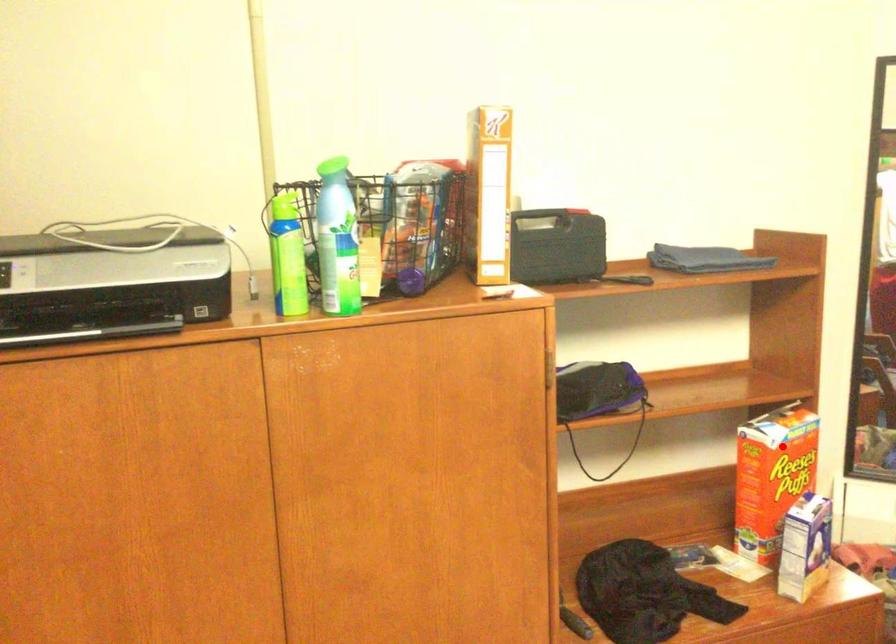
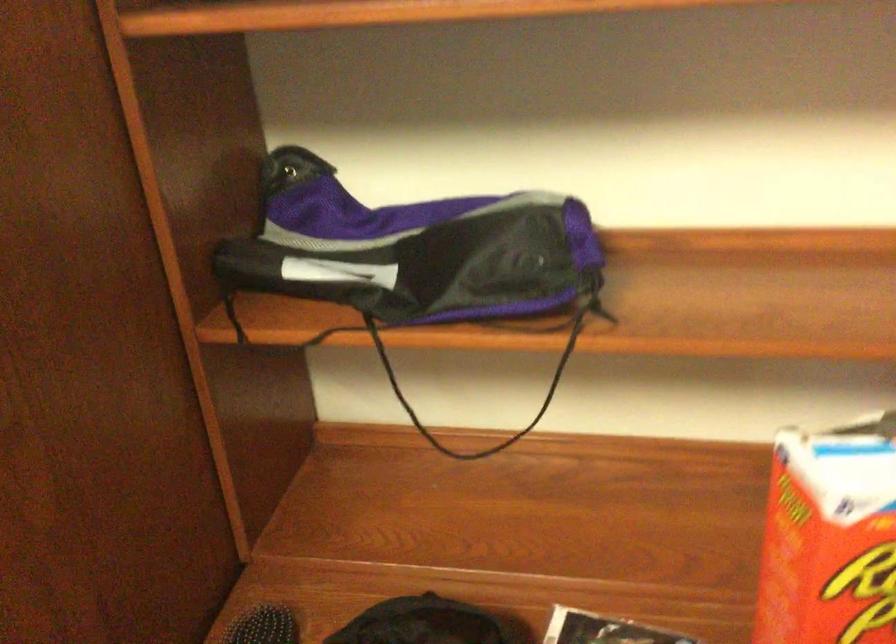
In the second image, find the point that corresponds to the highlighted location in the first image.

(830, 538)